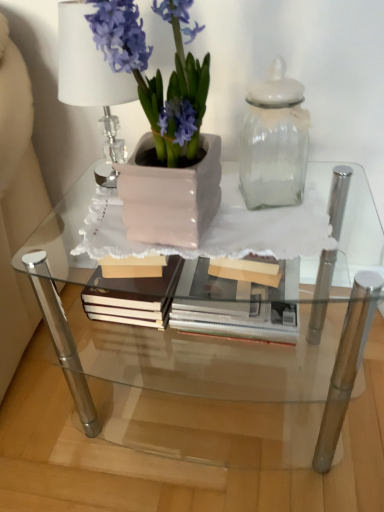
Image resolution: width=384 pixels, height=512 pixels. Identify the location of free spot below clear glass table at center (from a real-world perspective). (216, 386).